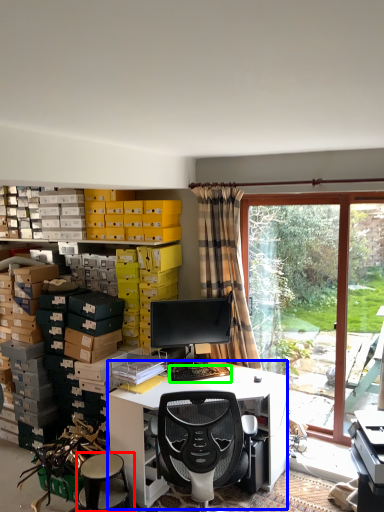
Question: Estimate the real-world distances between objects in this image. Which object is closer to stool (highlighted by a red box), desk (highlighted by a blue box) or computer keyboard (highlighted by a green box)?

Choices:
 (A) desk
 (B) computer keyboard

Answer: (A)